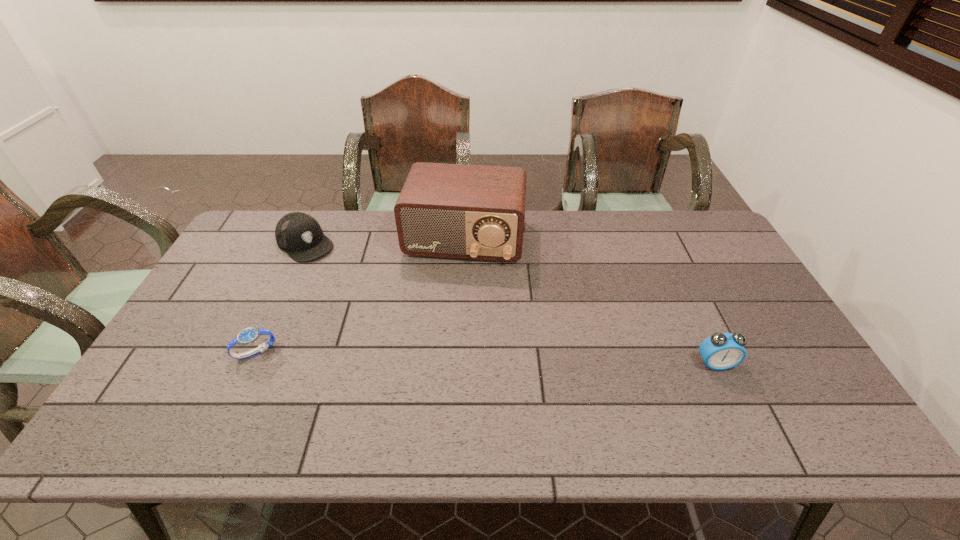
Locate an element on the screen. This screenshot has width=960, height=540. vacant space at the right edge is located at coordinates (747, 319).

Locate an element on the screen. vacant space at the far left corner is located at coordinates (275, 242).

You are a GUI agent. You are given a task and a screenshot of the screen. Output one action in this format:
    pyautogui.click(x=<x>, y=<y>)
    Task: Click on the blank space at the near left corner of the desktop
    The image size is (960, 540).
    Given the screenshot: What is the action you would take?
    pyautogui.click(x=197, y=396)

Find the location of a particular element. Image resolution: width=960 pixels, height=540 pixels. free region at the far right corner is located at coordinates (713, 248).

This screenshot has width=960, height=540. Find the location of `vacant point located between the tallest object and the cap`. vacant point located between the tallest object and the cap is located at coordinates (385, 241).

What are the coordinates of `vacant space that's between the watch and the tallest object` in the screenshot? It's located at (361, 296).

Locate an element on the screen. The height and width of the screenshot is (540, 960). free spot between the alarm clock and the shortest object is located at coordinates (486, 358).

Locate an element on the screen. This screenshot has width=960, height=540. vacant area that lies between the cap and the alarm clock is located at coordinates (511, 303).

Where is `free spot between the watch and the cap`? free spot between the watch and the cap is located at coordinates tap(280, 298).

The image size is (960, 540). I want to click on free point between the cap and the watch, so click(280, 298).